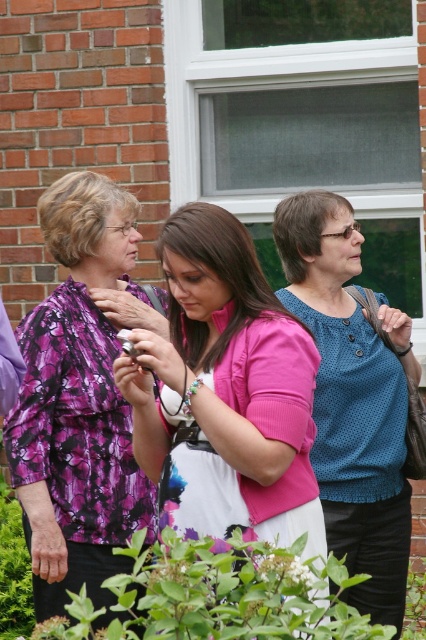
Based on the photo, which is more to the right, pink matte shirt at center or blue dotted blouse at center?

blue dotted blouse at center

Who is lower down, pink matte shirt at center or blue dotted blouse at center?

blue dotted blouse at center is lower down.

Is point (160, 346) positioned in front of point (359, 438)?

Yes, point (160, 346) is in front of point (359, 438).

Identify the location of pink matte shirt at center. The width and height of the screenshot is (426, 640). (224, 392).

Between point (199, 273) and point (117, 202), which one is positioned behind?

The point (117, 202) is behind.

Which is below, pink matte shirt at center or purple floral blouse at left?

purple floral blouse at left is lower down.

Who is more forward, [198,260] or [46,368]?

Point [198,260] is more forward.

This screenshot has width=426, height=640. In order to click on pink matte shirt at center in this screenshot , I will do `click(224, 392)`.

Who is more distant from viewer, (36, 598) or (368, 445)?

The point (368, 445) is more distant.

Measure the distance between purple floral blouse at left and camera.

purple floral blouse at left and camera are 4.20 meters apart.

Which is in front, point (68, 563) or point (402, 593)?

Point (68, 563) is in front.

Locate an element on the screen. Image resolution: width=426 pixels, height=640 pixels. purple floral blouse at left is located at coordinates (80, 397).